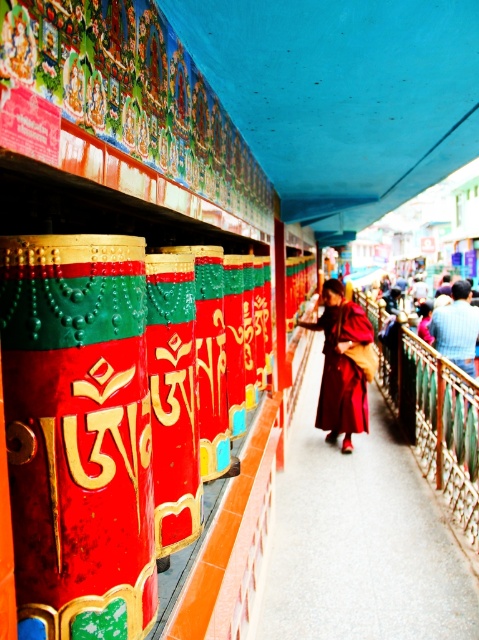
Does maroon fabric robe at center come in front of dark blue woolen robe at center?

Yes, it is.

Image resolution: width=479 pixels, height=640 pixels. I want to click on maroon fabric robe at center, so click(342, 365).

Where is `maroon fabric robe at center`? maroon fabric robe at center is located at coordinates (342, 365).

Find the location of a particular element. This screenshot has height=640, width=479. maroon fabric robe at center is located at coordinates (342, 365).